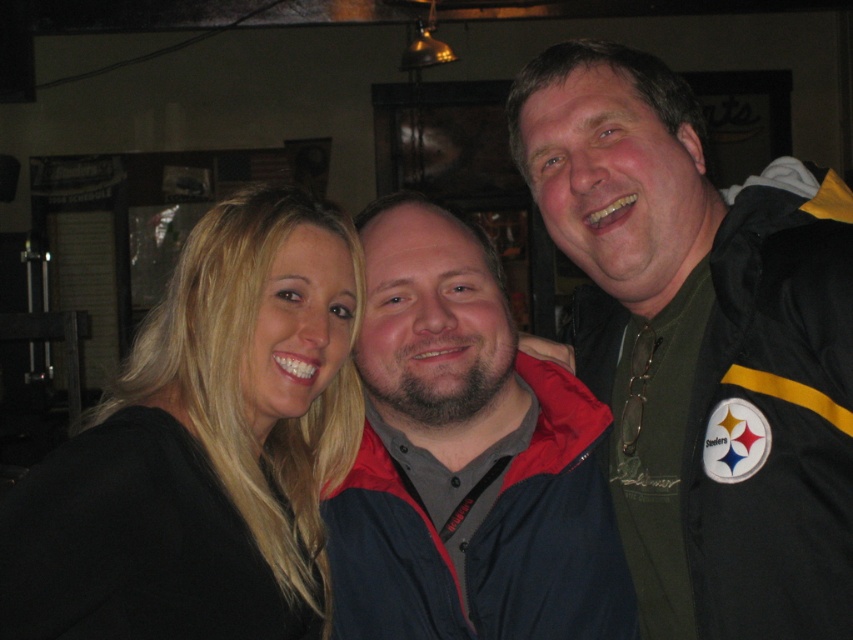
In the scene described, where exactly is the black fabric jacket at right located in terms of coordinates?

The black fabric jacket at right is located at coordinates point (701,346).

You are a photographer standing 5 feet away from the black fabric jacket at right and dark blue jacket at center. You want to capture both jackets in a single photo without moving either jacket. Can you fit both jackets into your camera frame if your camera has a maximum horizontal field of view of 10 inches at that distance?

The distance between the black fabric jacket at right and dark blue jacket at center is 10.79 inches. Since the camera can only capture 10 inches horizontally at that distance, the photographer cannot fit both jackets into the frame without moving them.

You are standing in the bar and want to touch the point at coordinates (701,346). Which object in the scene should you aim for?

The point at coordinates (701,346) is located on the black fabric jacket at right, so you should aim for the black fabric jacket at right.